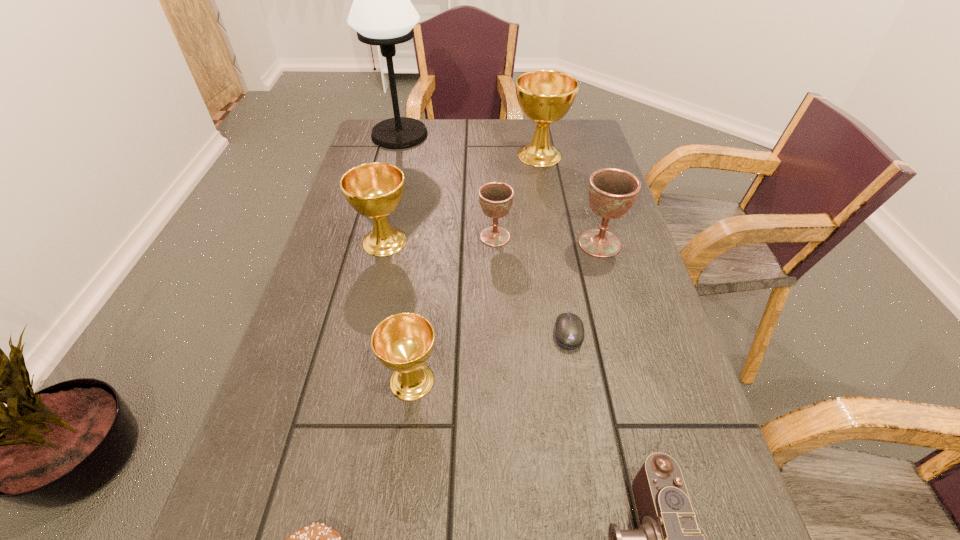
Locate an element on the screen. This screenshot has width=960, height=540. free space between the farthest chalice and the fourth nearest object is located at coordinates (554, 244).

You are a GUI agent. You are given a task and a screenshot of the screen. Output one action in this format:
    pyautogui.click(x=<x>, y=<y>)
    Task: Click on the free area in between the nearest chalice and the black computer mouse
    This screenshot has height=540, width=960.
    Given the screenshot: What is the action you would take?
    pyautogui.click(x=491, y=357)

What are the coordinates of `free point between the right brown chalice and the shortest object` in the screenshot? It's located at (584, 288).

The height and width of the screenshot is (540, 960). Find the location of `free space between the second nearest gold chalice and the second tallest object`. free space between the second nearest gold chalice and the second tallest object is located at coordinates (462, 198).

Identify the location of object that stands as the seventh closest to the right brown chalice. [x=382, y=14].

Identify the location of object that stands as the closest to the sixth farthest object. This screenshot has height=540, width=960. (612, 192).

You are a GUI agent. You are given a task and a screenshot of the screen. Output one action in this format:
    pyautogui.click(x=<x>, y=<y>)
    Task: Click on the chalice that stands as the closest to the fourth nearest object
    The width and height of the screenshot is (960, 540).
    Given the screenshot: What is the action you would take?
    pyautogui.click(x=612, y=192)

Select which chalice is the fifth closest to the camera. Please provide its 2D coordinates. Your answer should be formatted as a tuple, i.e. [(x, y)], where the tuple contains the x and y coordinates of a point satisfying the conditions above.

[(545, 96)]

Locate an element on the screen. gold chalice that can be found as the second closest to the eighth tallest object is located at coordinates (374, 190).

Point out which gold chalice is positioned as the nearest to the second farthest gold chalice. Please provide its 2D coordinates. Your answer should be formatted as a tuple, i.e. [(x, y)], where the tuple contains the x and y coordinates of a point satisfying the conditions above.

[(403, 342)]